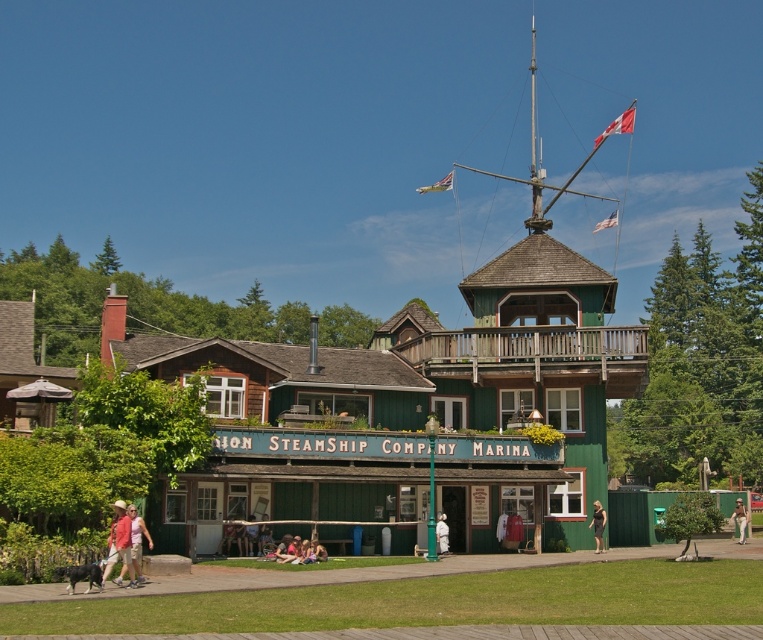
Question: Considering the real-world distances, which object is farthest from the matte red shirt at lower left?

Choices:
 (A) white cotton shirt at center
 (B) light brown fabric pants at center
 (C) matte pink shirt at lower left

Answer: (B)

Question: Does dark gray fabric dress at center have a greater width compared to light brown fabric pants at center?

Choices:
 (A) no
 (B) yes

Answer: (A)

Question: Which of the following is the closest to the observer?

Choices:
 (A) (496, 524)
 (B) (520, 536)
 (C) (132, 576)
 (D) (440, 516)

Answer: (C)

Question: Is light brown fabric pants at center to the left of white cotton dress at center from the viewer's perspective?

Choices:
 (A) no
 (B) yes

Answer: (A)

Question: Is matte red shirt at lower left further to camera compared to light brown fabric pants at center?

Choices:
 (A) yes
 (B) no

Answer: (B)

Question: Which object is farther from the camera taking this photo?

Choices:
 (A) dark gray fabric dress at center
 (B) matte red shirt at lower left

Answer: (A)